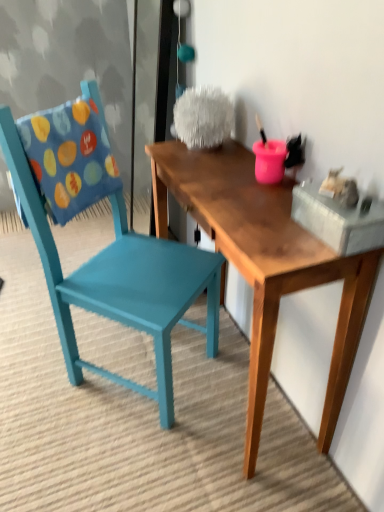
Locate an element on the screen. The width and height of the screenshot is (384, 512). vacant space underneath teal painted wood chair at left (from a real-world perspective) is located at coordinates (128, 362).